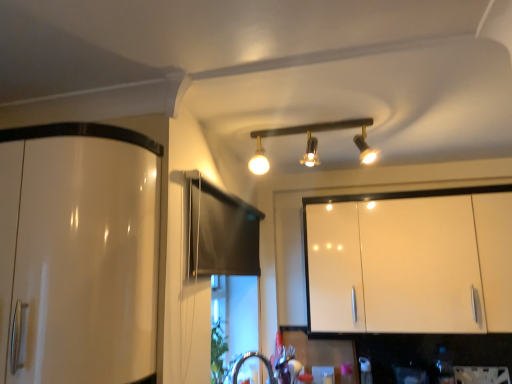
Question: From a real-world perspective, is glossy white cabinet at left, the 1th cabinetry positioned from the left, located beneath matte black track lights at center?

Choices:
 (A) no
 (B) yes

Answer: (B)

Question: Does glossy white cabinet at left, the second cabinetry positioned from the back, lie in front of matte black track lights at center?

Choices:
 (A) yes
 (B) no

Answer: (A)

Question: Is glossy white cabinet at left, acting as the first cabinetry starting from the front, placed right next to matte black track lights at center?

Choices:
 (A) no
 (B) yes

Answer: (A)

Question: From a real-world perspective, is glossy white cabinet at left, acting as the first cabinetry starting from the front, over matte black track lights at center?

Choices:
 (A) no
 (B) yes

Answer: (A)

Question: Can you confirm if glossy white cabinet at left, placed as the second cabinetry when sorted from right to left, is shorter than matte black track lights at center?

Choices:
 (A) yes
 (B) no

Answer: (B)

Question: Is white glossy cabinet at upper right, which is the first cabinetry in back-to-front order, taller or shorter than matte black track lights at center?

Choices:
 (A) short
 (B) tall

Answer: (B)

Question: Looking at the image, does white glossy cabinet at upper right, the 2th cabinetry positioned from the left, seem bigger or smaller compared to matte black track lights at center?

Choices:
 (A) big
 (B) small

Answer: (A)

Question: From the image's perspective, is white glossy cabinet at upper right, which is the first cabinetry in back-to-front order, located above or below matte black track lights at center?

Choices:
 (A) below
 (B) above

Answer: (A)

Question: Would you say white glossy cabinet at upper right, the 2th cabinetry positioned from the left, is inside or outside matte black track lights at center?

Choices:
 (A) outside
 (B) inside

Answer: (A)

Question: Considering the relative positions of matte black track lights at center and glossy white cabinet at left, acting as the first cabinetry starting from the front, in the image provided, is matte black track lights at center to the left or to the right of glossy white cabinet at left, acting as the first cabinetry starting from the front,?

Choices:
 (A) left
 (B) right

Answer: (B)

Question: Looking at the image, does matte black track lights at center seem bigger or smaller compared to glossy white cabinet at left, the 1th cabinetry positioned from the left?

Choices:
 (A) big
 (B) small

Answer: (B)

Question: Is matte black track lights at center situated inside glossy white cabinet at left, the 1th cabinetry positioned from the left, or outside?

Choices:
 (A) outside
 (B) inside

Answer: (A)

Question: Does point (260, 135) appear closer or farther from the camera than point (74, 193)?

Choices:
 (A) closer
 (B) farther

Answer: (B)

Question: From a real-world perspective, is matte black track lights at center above or below white glossy cabinet at upper right, acting as the 1th cabinetry starting from the right?

Choices:
 (A) below
 (B) above

Answer: (B)

Question: Is point (366, 160) positioned closer to the camera than point (437, 254)?

Choices:
 (A) farther
 (B) closer

Answer: (A)